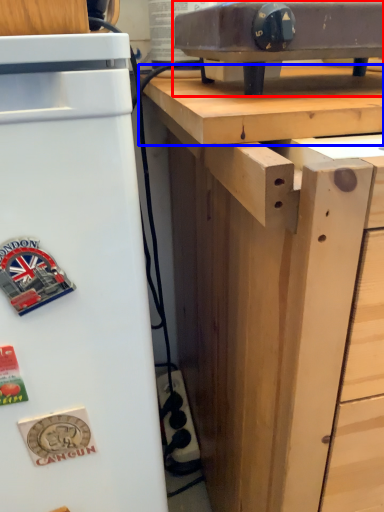
Question: Which point is further to the camera, appliance (highlighted by a red box) or wood (highlighted by a blue box)?

Choices:
 (A) appliance
 (B) wood

Answer: (A)